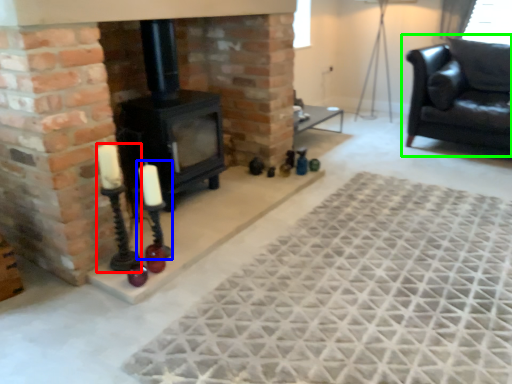
Question: Which object is positioned closest to candle holder (highlighted by a red box)? Select from candle holder (highlighted by a blue box) and studio couch (highlighted by a green box).

Choices:
 (A) candle holder
 (B) studio couch

Answer: (A)